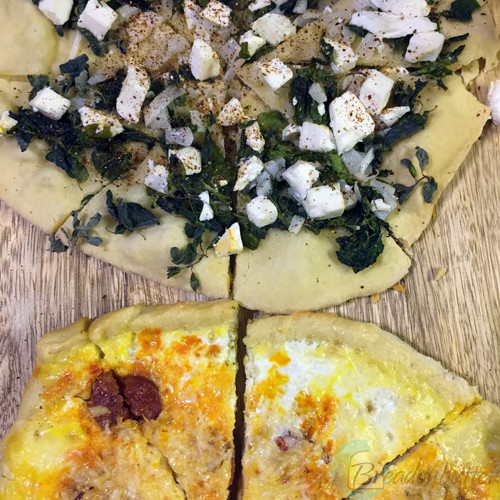
You are a GUI agent. You are given a task and a screenshot of the screen. Output one action in this format:
    pyautogui.click(x=<x>, y=<y>)
    Task: Click on the table
    The image size is (500, 500).
    Given the screenshot: What is the action you would take?
    pyautogui.click(x=450, y=304)